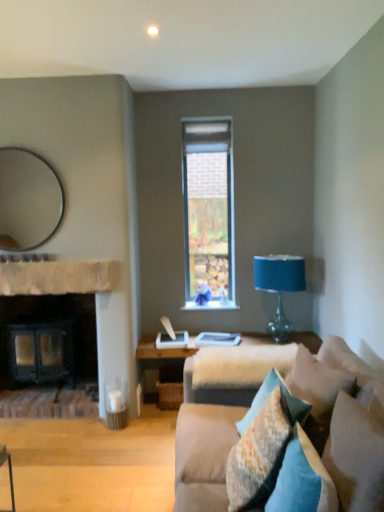
The height and width of the screenshot is (512, 384). What are the coordinates of `blank area beneath brown stone fireplace at left (from a real-world perspective)` in the screenshot? It's located at tap(71, 417).